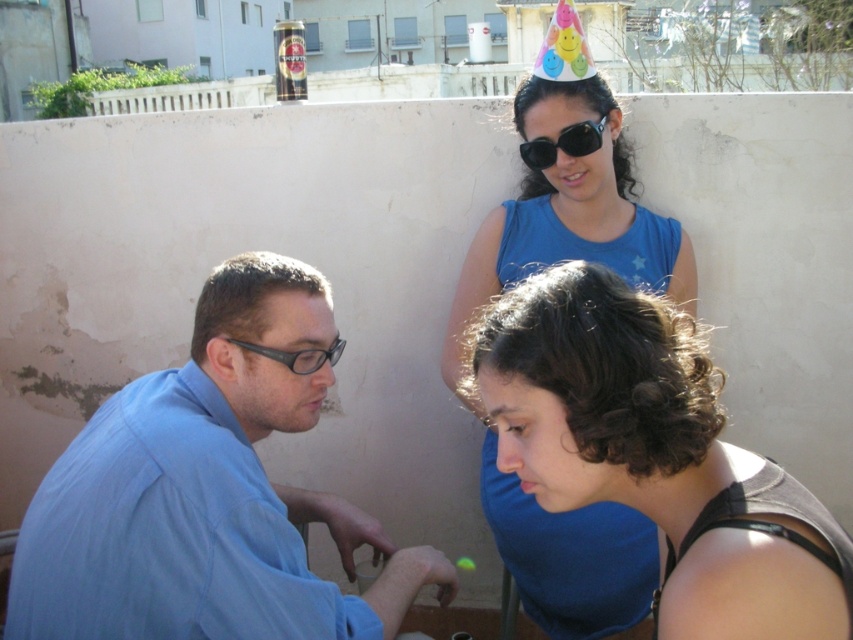
You are a photographer trying to capture a closeup of the dark brown curly hair at lower right and the matte black glasses at left. Since you want both subjects in focus, which one should you adjust your camera focus to prioritize first?

The dark brown curly hair at lower right is bigger than matte black glasses at left, so you should prioritize focusing on the dark brown curly hair at lower right first to ensure it is in focus before adjusting for the smaller matte black glasses at left.

You are a photographer trying to capture a closeup of the blue shirt at left and the matte black glasses at left. Which object should you focus on first if you want to ensure both are in focus?

The blue shirt at left is below matte black glasses at left, so you should focus on the blue shirt at left first to ensure both are in focus.